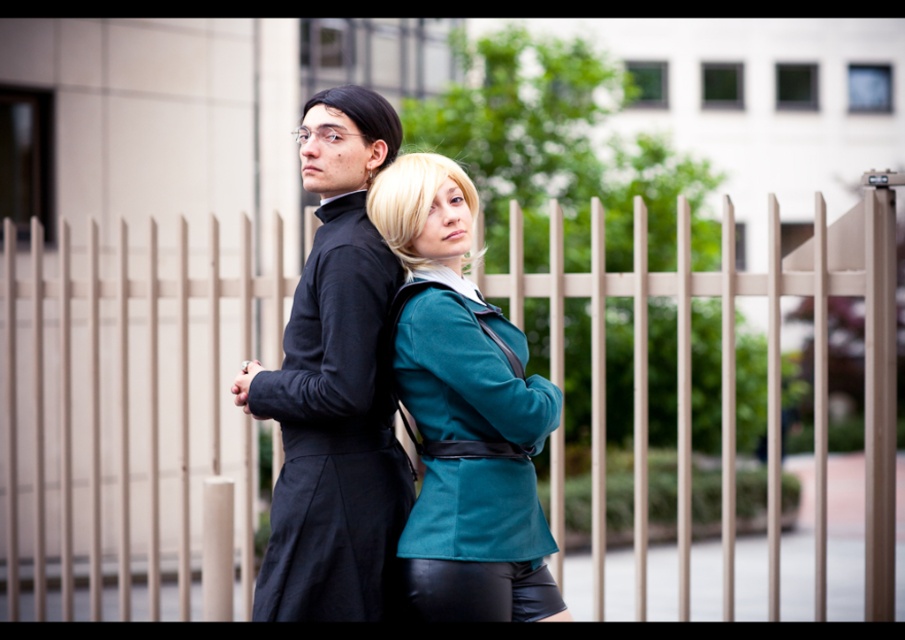
You are a photographer standing at a certain distance from the metallic silver fence at center. You want to capture a clear photo of the fence without any blur. Given that the camera requires a minimum focus distance of 5 meters to avoid blur, can you take the photo from your current position?

The distance between the metallic silver fence at center and the camera is 7.06 meters, which is greater than the minimum focus distance of 5 meters required to avoid blur. Therefore, you can take a clear photo of the metallic silver fence at center from your current position without any blur.

You are a photographer standing at a certain distance from the matte black suit at center. You want to take a closeup shot of it without moving your position. What should you do?

You should use a zoom lens to focus on the matte black suit at center since it is 4.64 meters away from the camera and you cannot move closer.